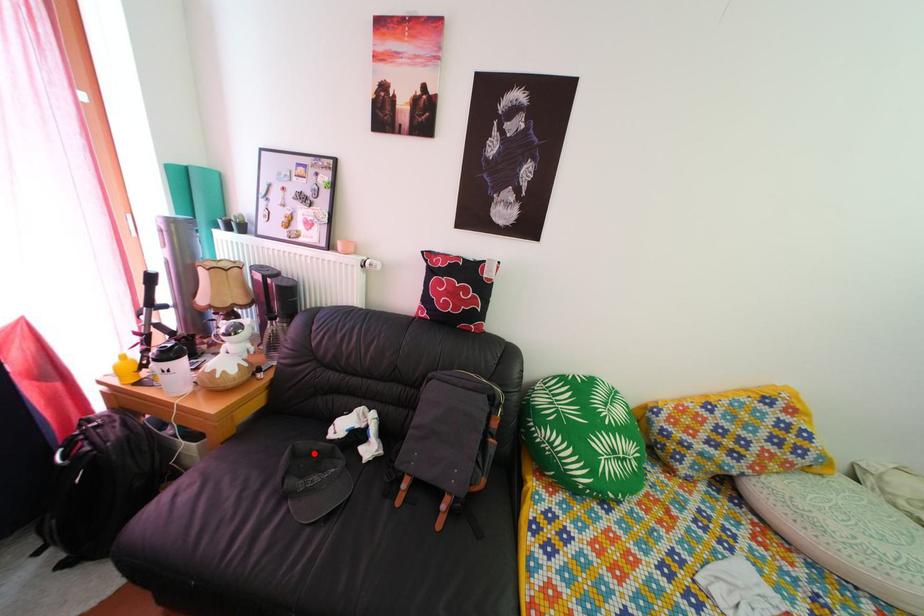
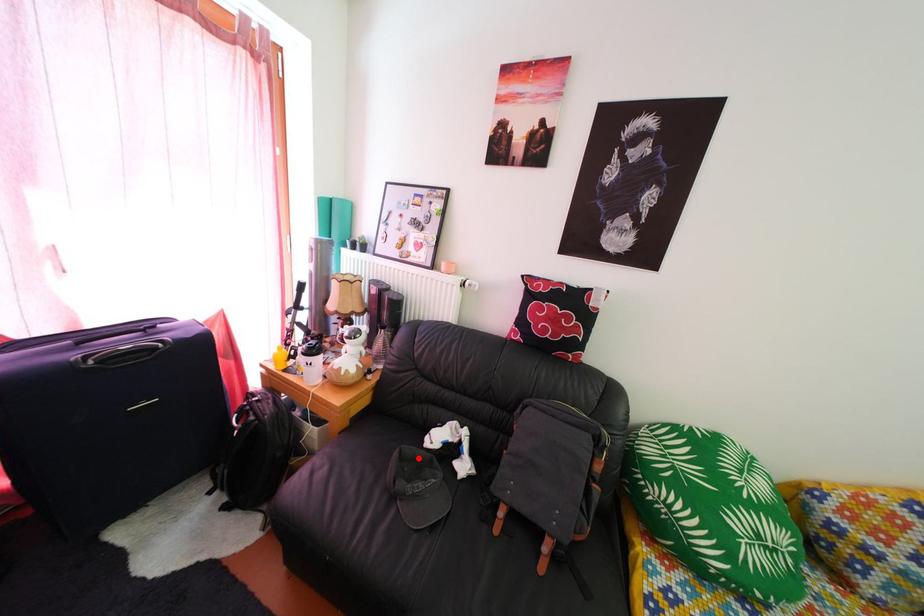
I am providing you with two images of the same scene from different viewpoints. A red point is marked on the first image and another point is marked on the second image. Do the highlighted points in image1 and image2 indicate the same real-world spot?

Yes